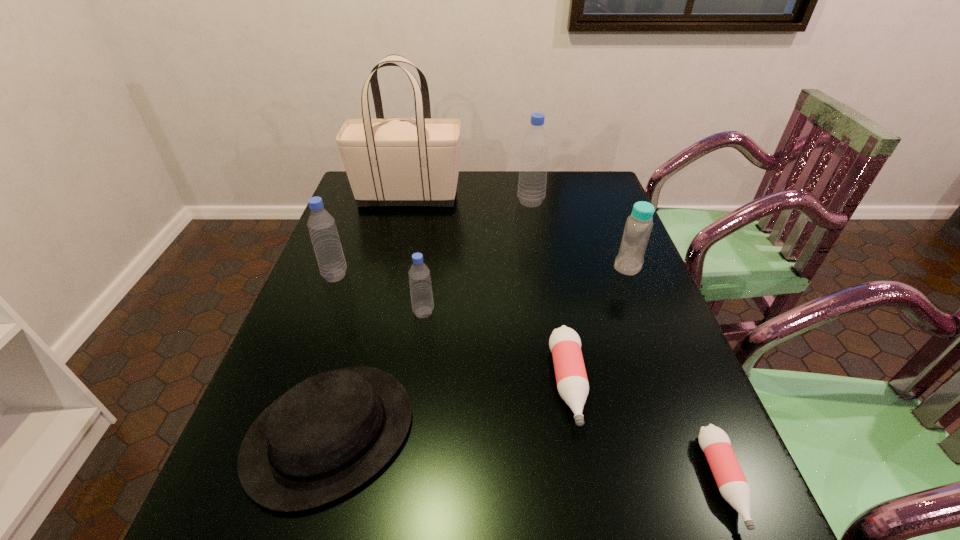
Locate an element on the screen. The height and width of the screenshot is (540, 960). shopping bag is located at coordinates (398, 161).

Find the location of `gray shopping bag`. gray shopping bag is located at coordinates (398, 161).

The image size is (960, 540). Find the location of `the second tallest object`. the second tallest object is located at coordinates click(x=531, y=192).

Identify the location of the farthest blue bottle. Image resolution: width=960 pixels, height=540 pixels. (531, 192).

The height and width of the screenshot is (540, 960). What are the coordinates of `the second biggest blue bottle` in the screenshot? It's located at (322, 228).

Locate an element on the screen. The height and width of the screenshot is (540, 960). the fifth shortest bottle is located at coordinates tap(322, 228).

At what (x,y) coordinates should I click in order to perform the action: click on the rightmost blue bottle. Please return your answer as a coordinate pair (x, y). This screenshot has height=540, width=960. Looking at the image, I should click on (629, 261).

Where is `the third blue bottle from right to left`? The height and width of the screenshot is (540, 960). the third blue bottle from right to left is located at coordinates (421, 293).

Find the location of a particular element. the fifth farthest object is located at coordinates (421, 293).

Where is `fedora`? fedora is located at coordinates (326, 436).